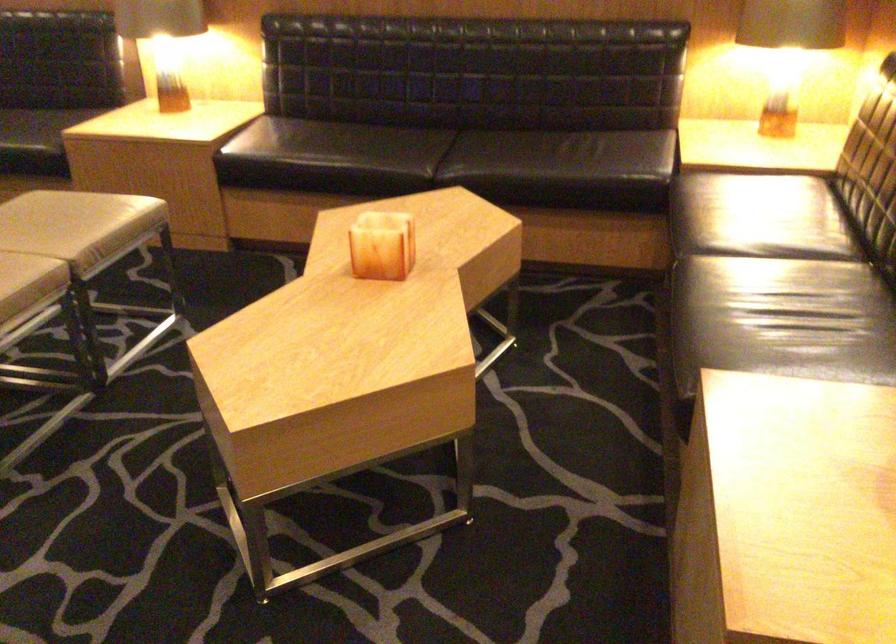
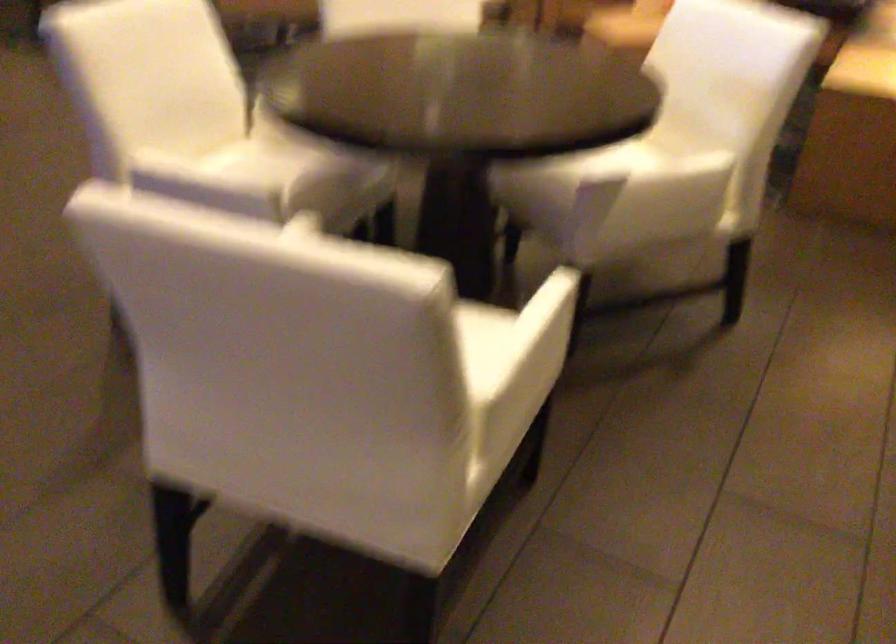
Question: In a continuous first-person perspective shot, in which direction is the camera moving?

Choices:
 (A) Left
 (B) Right
 (C) Forward
 (D) Backward

Answer: (D)